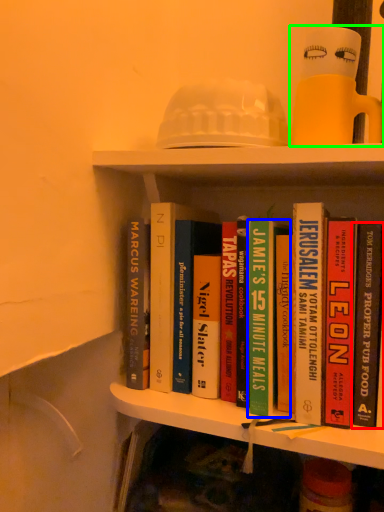
Question: Considering the real-world distances, which object is farthest from book (highlighted by a red box)? book (highlighted by a blue box) or toy (highlighted by a green box)?

Choices:
 (A) book
 (B) toy

Answer: (B)